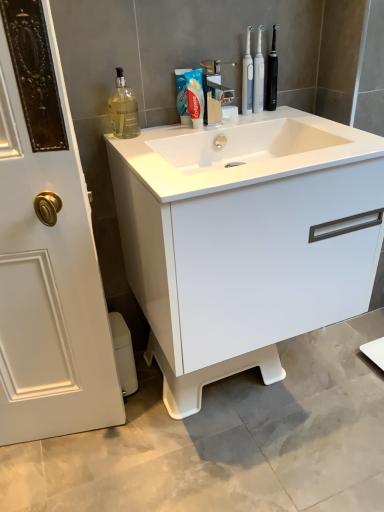
Where is `free space to the right of clear plastic toothbrushes at upper center`? free space to the right of clear plastic toothbrushes at upper center is located at coordinates (290, 117).